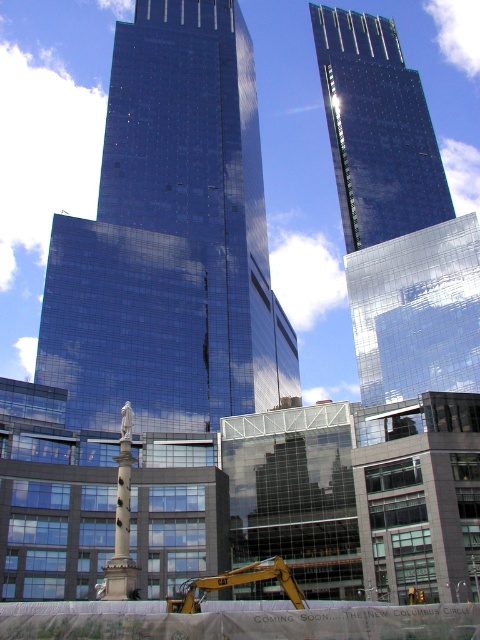
Question: Is glossy glass skyscraper at center above white marble statue at lower center?

Choices:
 (A) yes
 (B) no

Answer: (A)

Question: Which point appears closest to the camera in this image?

Choices:
 (A) (126, 404)
 (B) (251, 179)
 (C) (372, 230)

Answer: (A)

Question: Can you confirm if glossy glass skyscraper at upper center is positioned below yellow metallic excavator at lower center?

Choices:
 (A) no
 (B) yes

Answer: (A)

Question: Observing the image, what is the correct spatial positioning of glossy glass skyscraper at center in reference to white marble statue at lower center?

Choices:
 (A) left
 (B) right

Answer: (B)

Question: Which of the following is the closest to the observer?

Choices:
 (A) (276, 561)
 (B) (129, 403)

Answer: (A)

Question: Which of the following is the farthest from the observer?

Choices:
 (A) (122, 438)
 (B) (312, 22)
 (C) (186, 188)
 (D) (216, 589)

Answer: (B)